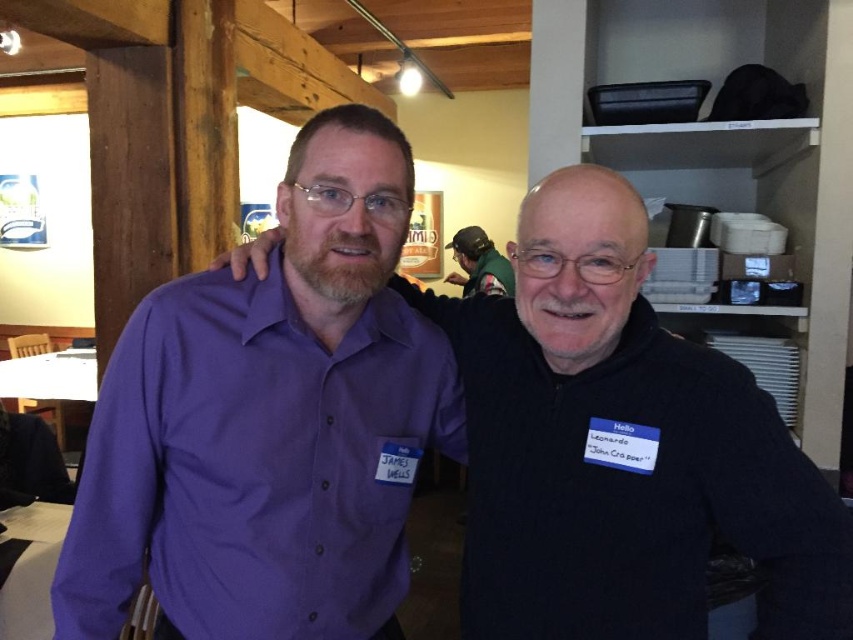
You are at a social event and want to approach the person wearing the purple button up shirt. The coordinates of the purple shirt are given as point [624,445]. If you are standing at the origin point, which direction should you move to reach the purple shirt?

The point [624,445] is located on the purple shirt at center, so you should move towards the center of the image to reach the purple shirt.

You are organizing a group photo and need to arrange two people based on their shirt widths. The purple shirt at center and the green fabric shirt at upper center are in the scene. Which shirt should be placed on the right side if you want the wider shirt to be on the left?

The purple shirt at center might be wider than green fabric shirt at upper center, so to have the wider shirt on the left, place the purple shirt at center on the left and the green fabric shirt at upper center on the right.